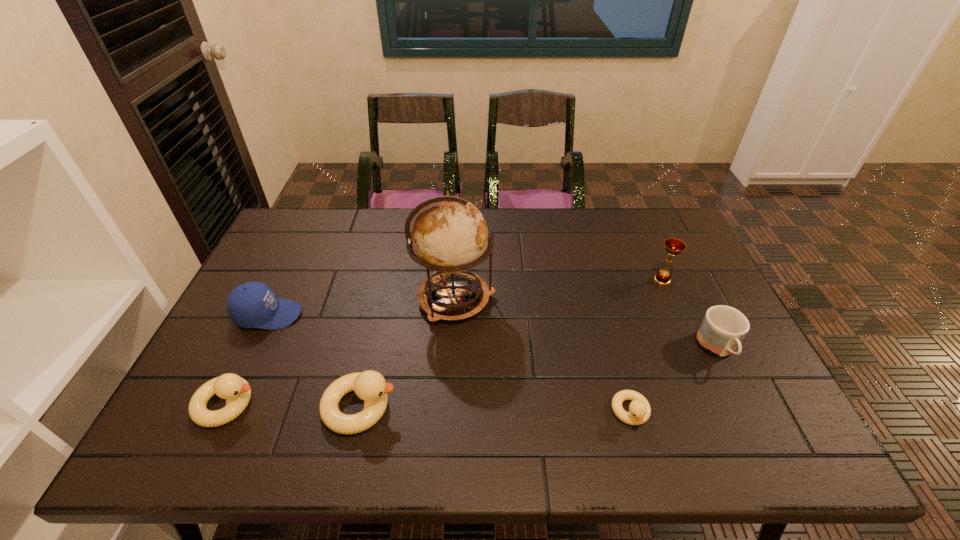
You are a GUI agent. You are given a task and a screenshot of the screen. Output one action in this format:
    pyautogui.click(x=<x>, y=<y>)
    Task: Click on the second shortest duckling
    The width and height of the screenshot is (960, 540).
    Given the screenshot: What is the action you would take?
    click(236, 391)

Locate an element on the screen. The width and height of the screenshot is (960, 540). the second duckling from right to left is located at coordinates (370, 386).

Locate an element on the screen. the rightmost duckling is located at coordinates (639, 412).

I want to click on the shortest object, so click(639, 412).

Locate an element on the screen. Image resolution: width=960 pixels, height=540 pixels. mug is located at coordinates (723, 328).

This screenshot has width=960, height=540. I want to click on chalice, so click(x=673, y=246).

Identify the location of cap. (252, 304).

You are a GUI agent. You are given a task and a screenshot of the screen. Output one action in this format:
    pyautogui.click(x=<x>, y=<y>)
    Task: Click on the tallest object
    The width and height of the screenshot is (960, 540).
    Given the screenshot: What is the action you would take?
    click(x=450, y=235)

Find the location of `vacant area situated at the beak of the second shortest duckling`. vacant area situated at the beak of the second shortest duckling is located at coordinates (396, 404).

Identify the location of free region located at the beak of the second duckling from left to right. Image resolution: width=960 pixels, height=540 pixels. (548, 407).